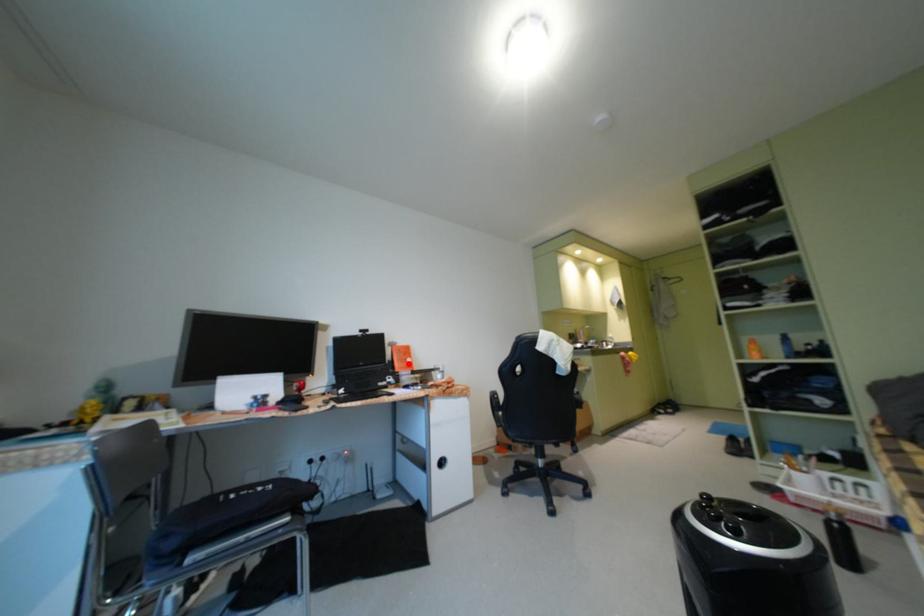
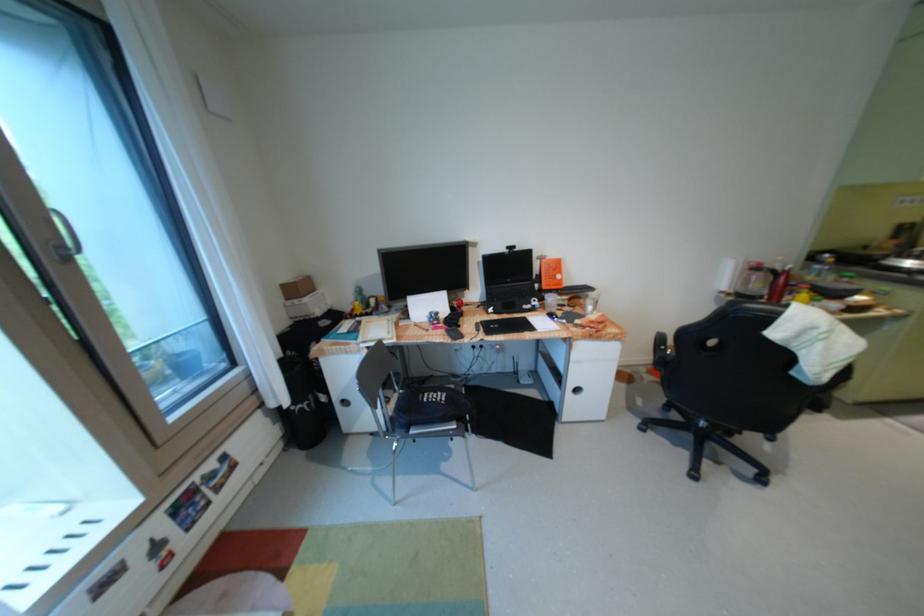
Question: A red point is marked in image1. In image2, is the corresponding 3D point closer to the camera or farther? Reply with the corresponding letter.

Choices:
 (A) The corresponding 3D point is closer.
 (B) The corresponding 3D point is farther.

Answer: (A)